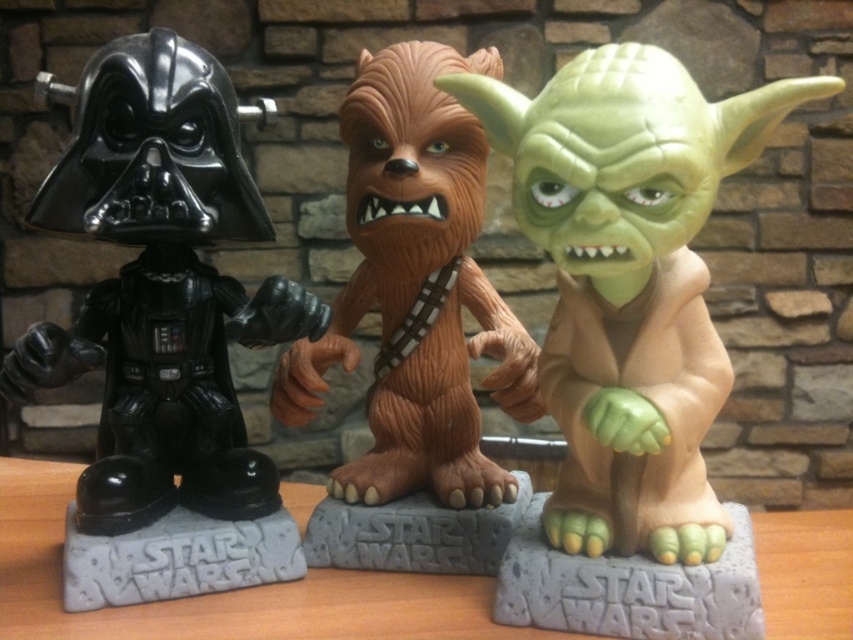
Between matte black helmet at left and brown textured fur at center, which one has more height?

Standing taller between the two is matte black helmet at left.

Can you confirm if matte black helmet at left is positioned below brown textured fur at center?

Correct, matte black helmet at left is located below brown textured fur at center.

Does point (202, 214) come closer to viewer compared to point (416, 172)?

Yes.

Identify the location of matte black helmet at left. (163, 330).

How much distance is there between matte black helmet at left and green matte yoda at center?

25.81 centimeters

Which is more to the left, matte black helmet at left or green matte yoda at center?

From the viewer's perspective, matte black helmet at left appears more on the left side.

At what (x,y) coordinates should I click in order to perform the action: click on matte black helmet at left. Please return your answer as a coordinate pair (x, y). This screenshot has height=640, width=853. Looking at the image, I should click on (163, 330).

Where is `matte black helmet at left`? The width and height of the screenshot is (853, 640). matte black helmet at left is located at coordinates (163, 330).

Can you confirm if green matte yoda at center is shorter than brown textured fur at center?

Yes, green matte yoda at center is shorter than brown textured fur at center.

Between point (688, 90) and point (384, 324), which one is positioned behind?

Point (384, 324)

Identify the location of green matte yoda at center. (630, 282).